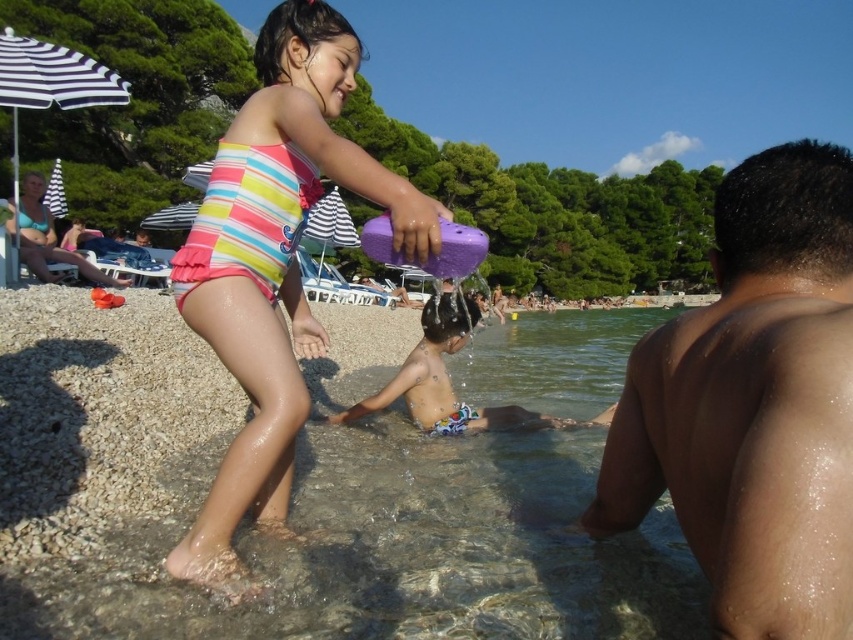
Identify the location of shiny wet skin at lower right. The image size is (853, 640). (753, 404).

At what (x,y) coordinates should I click in order to perform the action: click on shiny wet skin at lower right. Please return your answer as a coordinate pair (x, y). This screenshot has height=640, width=853. Looking at the image, I should click on (753, 404).

Consider the image. Who is taller, clear water at lower center or striped fabric swimsuit at center?

With more height is striped fabric swimsuit at center.

Does clear water at lower center appear under striped fabric swimsuit at center?

Yes.

At what (x,y) coordinates should I click in order to perform the action: click on clear water at lower center. Please return your answer as a coordinate pair (x, y). Looking at the image, I should click on (292, 506).

Where is `clear water at lower center`? The width and height of the screenshot is (853, 640). clear water at lower center is located at coordinates (292, 506).

Which is behind, point (297, 186) or point (450, 285)?

The point (450, 285) is more distant.

Is point (201, 291) less distant than point (358, 413)?

Yes.

This screenshot has height=640, width=853. What do you see at coordinates (276, 262) in the screenshot? I see `striped fabric swimsuit at center` at bounding box center [276, 262].

At what (x,y) coordinates should I click in order to perform the action: click on striped fabric swimsuit at center. Please return your answer as a coordinate pair (x, y). Looking at the image, I should click on (276, 262).